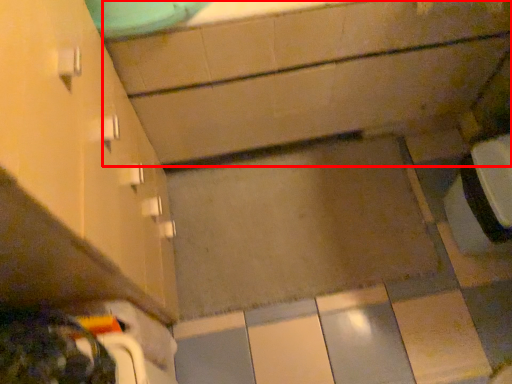
Question: From the image's perspective, what is the correct spatial relationship of bath (annotated by the red box) in relation to cabinetry?

Choices:
 (A) below
 (B) above

Answer: (B)